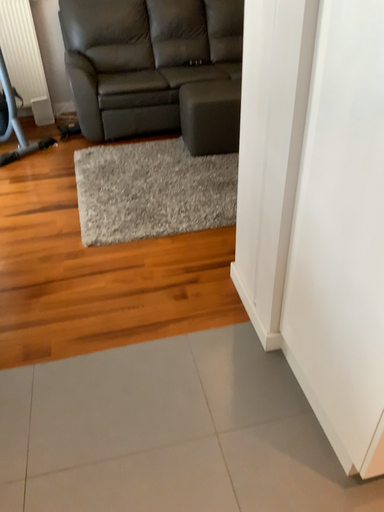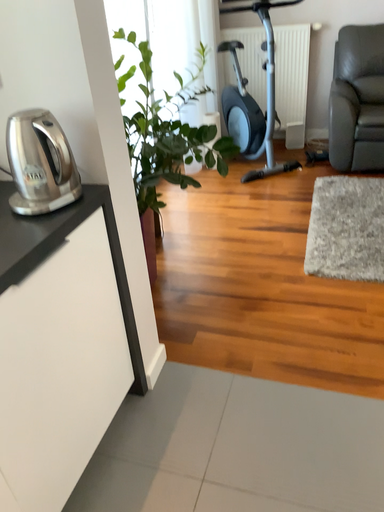
Question: Which way did the camera rotate in the video?

Choices:
 (A) rotated left
 (B) rotated right

Answer: (A)